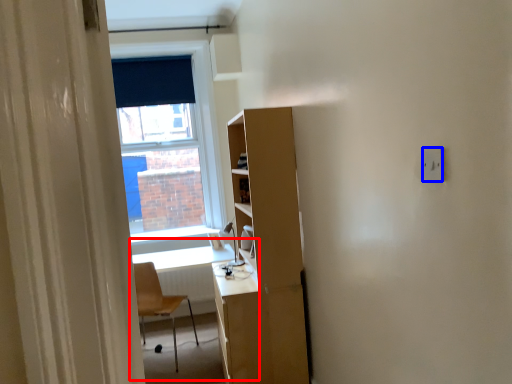
Question: Among these objects, which one is farthest to the camera, computer desk (highlighted by a red box) or electric outlet (highlighted by a blue box)?

Choices:
 (A) computer desk
 (B) electric outlet

Answer: (A)